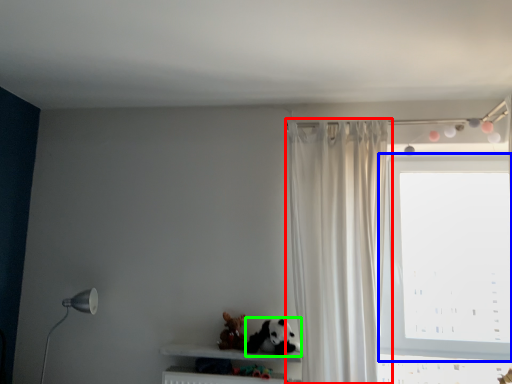
Question: Which object is the closest to the curtain (highlighted by a red box)? Choose among these: window (highlighted by a blue box) or animal (highlighted by a green box).

Choices:
 (A) window
 (B) animal

Answer: (B)